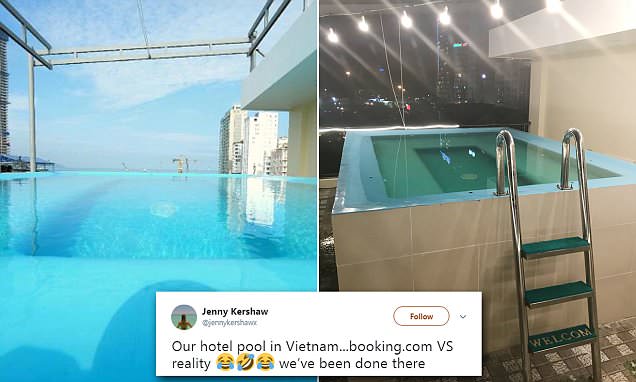
This screenshot has height=382, width=636. Identify the location of hotel. (212, 343).